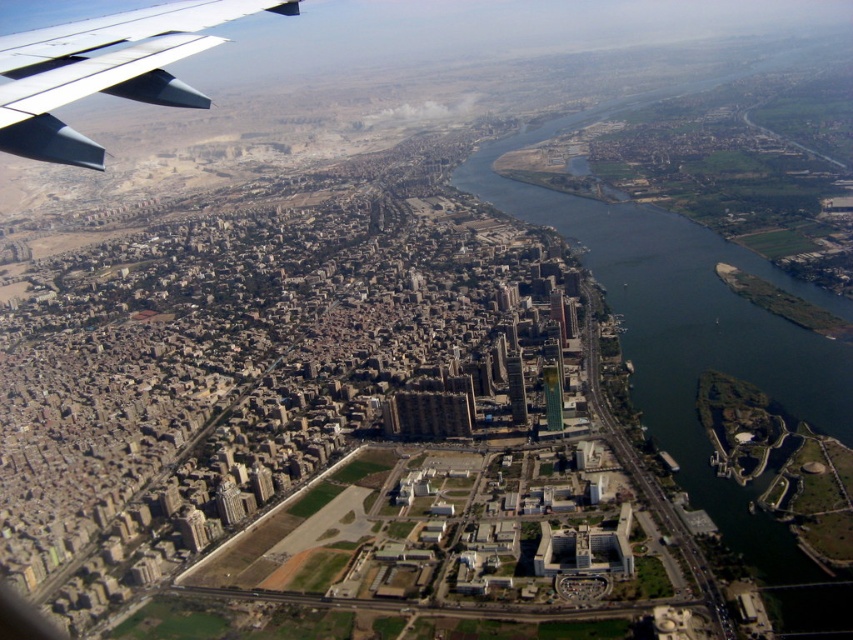
Question: Considering the relative positions of green water at center right and metallic gray wing at upper left in the image provided, where is green water at center right located with respect to metallic gray wing at upper left?

Choices:
 (A) left
 (B) right

Answer: (B)

Question: In this image, where is green water at center right located relative to metallic gray wing at upper left?

Choices:
 (A) right
 (B) left

Answer: (A)

Question: Which point is closer to the camera taking this photo?

Choices:
 (A) (184, 106)
 (B) (701, 506)

Answer: (A)

Question: Which point is farther to the camera?

Choices:
 (A) (700, 496)
 (B) (27, 99)

Answer: (A)

Question: Observing the image, what is the correct spatial positioning of green water at center right in reference to metallic gray wing at upper left?

Choices:
 (A) left
 (B) right

Answer: (B)

Question: Which of the following is the closest to the observer?

Choices:
 (A) green water at center right
 (B) metallic gray wing at upper left

Answer: (B)